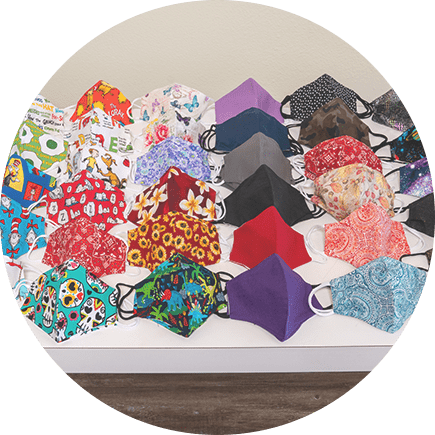
What are the coordinates of `tan background wall` in the screenshot? It's located at (197, 27).